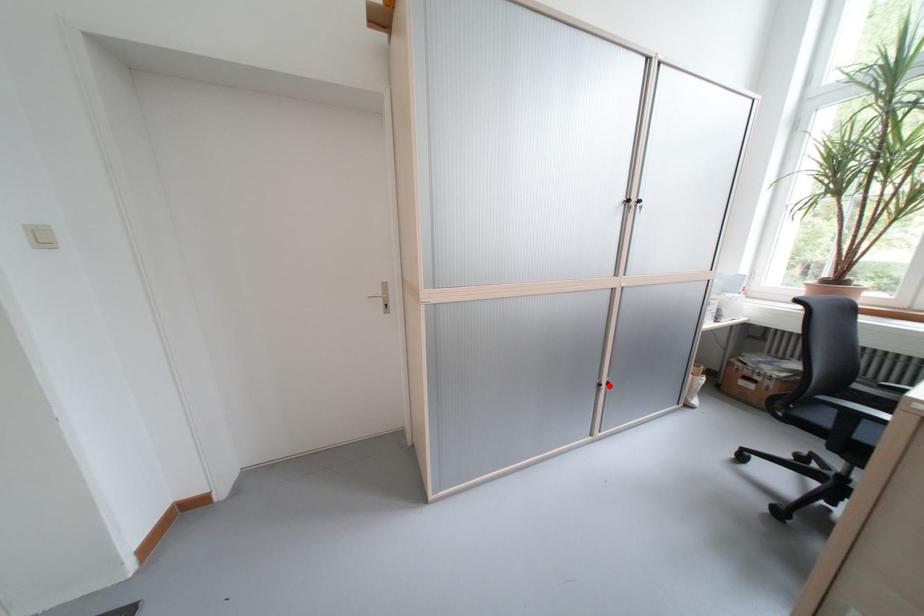
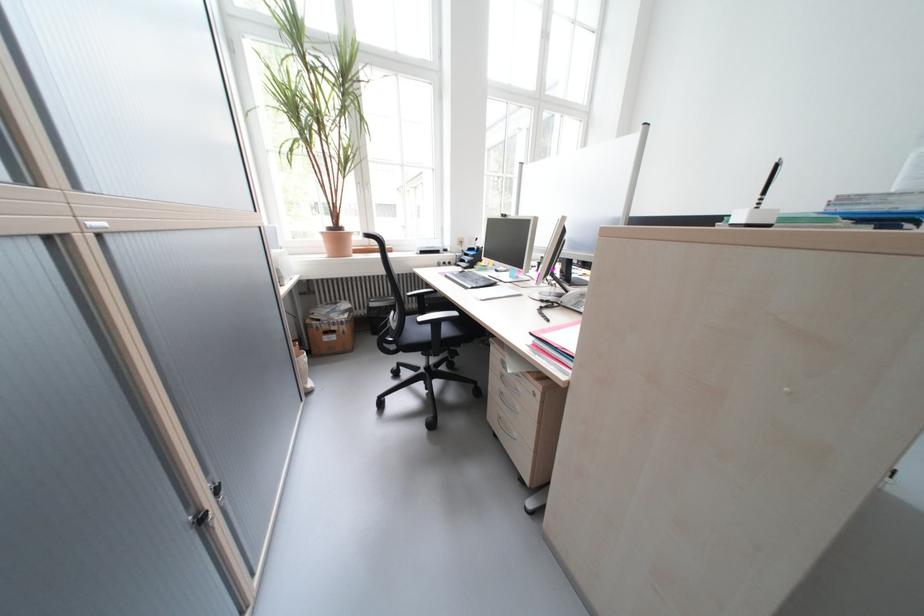
The point at the highlighted location is marked in the first image. Where is the corresponding point in the second image?

(213, 521)